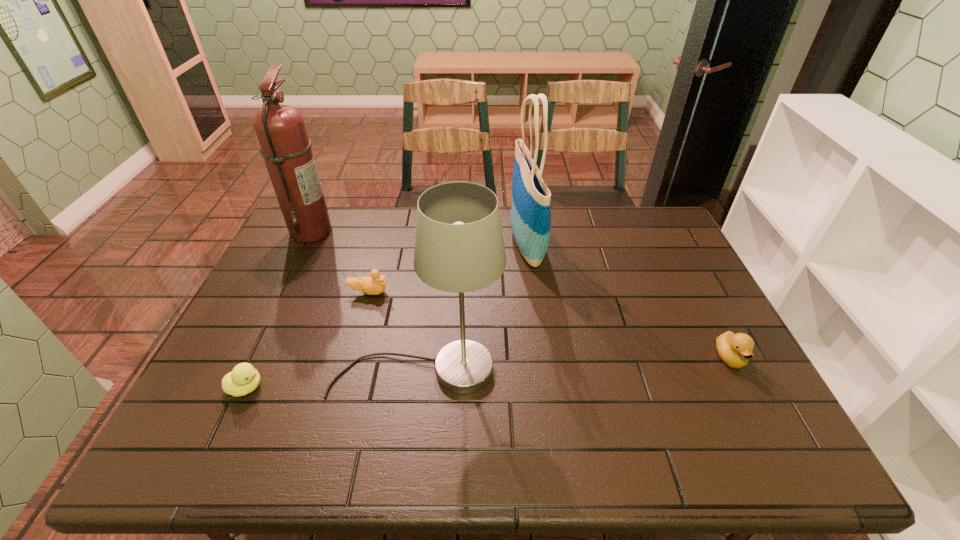
Locate an element on the screen. vacant space at the near edge of the desktop is located at coordinates (539, 451).

Locate an element on the screen. The image size is (960, 540). free space at the left edge of the desktop is located at coordinates (276, 349).

At what (x,y) coordinates should I click in order to perform the action: click on blank area at the near right corner. Please return your answer as a coordinate pair (x, y). The width and height of the screenshot is (960, 540). Looking at the image, I should click on (715, 443).

I want to click on empty space between the leftmost duckling and the second object from right to left, so click(386, 315).

What are the coordinates of `free space that is in between the rightmost object and the second object from right to left` in the screenshot? It's located at (629, 301).

Where is `free spot between the second object from right to left and the rightmost object`? The image size is (960, 540). free spot between the second object from right to left and the rightmost object is located at coordinates (629, 301).

The width and height of the screenshot is (960, 540). Identify the location of vacant space that is in between the rightmost duckling and the table lamp. coord(573,364).

This screenshot has width=960, height=540. Identify the location of unoccupied position between the fire extinguisher and the leftmost duckling. (278, 309).

This screenshot has height=540, width=960. I want to click on free space between the farthest duckling and the leftmost duckling, so click(307, 340).

Locate an element on the screen. The image size is (960, 540). free spot between the leftmost duckling and the second duckling from left to right is located at coordinates (307, 340).